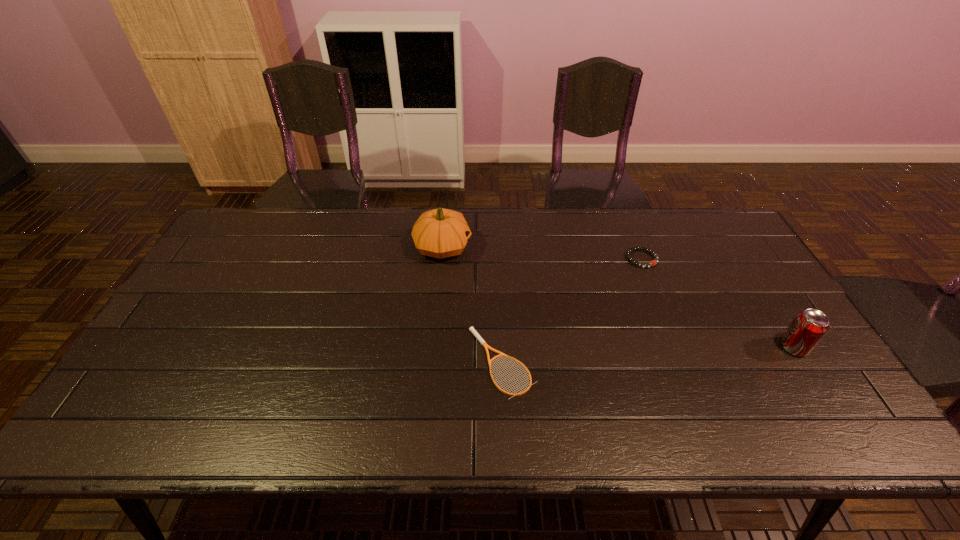
Where is `vacant area that lies between the second object from right to left and the second tallest object`? vacant area that lies between the second object from right to left and the second tallest object is located at coordinates (718, 303).

Locate an element on the screen. The image size is (960, 540). vacant region between the soda can and the tallest object is located at coordinates (618, 297).

Find the location of a particular element. Image resolution: width=960 pixels, height=540 pixels. free space between the gourd and the rightmost object is located at coordinates (618, 297).

Image resolution: width=960 pixels, height=540 pixels. I want to click on vacant point located between the shortest object and the third tallest object, so click(x=572, y=310).

Where is `vacant region between the bracelet and the shortest object`? The height and width of the screenshot is (540, 960). vacant region between the bracelet and the shortest object is located at coordinates (572, 310).

Where is `free space between the tallest object and the soda can`? free space between the tallest object and the soda can is located at coordinates pyautogui.click(x=618, y=297).

Image resolution: width=960 pixels, height=540 pixels. What are the coordinates of `object that is the third nearest to the second shortest object` in the screenshot? It's located at (439, 233).

Image resolution: width=960 pixels, height=540 pixels. I want to click on object that is the closest one to the shortest object, so click(x=439, y=233).

You are a GUI agent. You are given a task and a screenshot of the screen. Output one action in this format:
    pyautogui.click(x=<x>, y=<y>)
    Task: Click on the free spot that satisfies the following two spatial constraints: 1. on the side of the tallest object with the carved face; 2. on the right side of the second shortest object
    
    Given the screenshot: What is the action you would take?
    [442, 259]

Find the location of `vacant space that satisfies the following two spatial constraints: 1. on the side of the tennis racket with the carved face; 2. on the left side of the tallest object`. vacant space that satisfies the following two spatial constraints: 1. on the side of the tennis racket with the carved face; 2. on the left side of the tallest object is located at coordinates (432, 362).